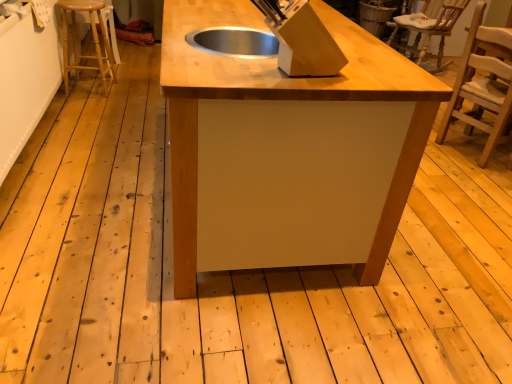
Question: Considering the relative positions of light brown wooden chair at right, placed as the first chair when sorted from bottom to top, and matte wood table at center in the image provided, is light brown wooden chair at right, placed as the first chair when sorted from bottom to top, to the right of matte wood table at center from the viewer's perspective?

Choices:
 (A) no
 (B) yes

Answer: (B)

Question: Considering the relative sizes of light brown wooden chair at right, placed as the first chair when sorted from bottom to top, and matte wood table at center in the image provided, is light brown wooden chair at right, placed as the first chair when sorted from bottom to top, shorter than matte wood table at center?

Choices:
 (A) yes
 (B) no

Answer: (B)

Question: Is light brown wooden chair at right, which is counted as the 2th chair, starting from the top, smaller than matte wood table at center?

Choices:
 (A) yes
 (B) no

Answer: (A)

Question: Can matte wood table at center be found inside light brown wooden chair at right, which is counted as the 2th chair, starting from the top?

Choices:
 (A) yes
 (B) no

Answer: (B)

Question: Does light brown wooden chair at right, placed as the first chair when sorted from bottom to top, come in front of matte wood table at center?

Choices:
 (A) yes
 (B) no

Answer: (B)

Question: Can you confirm if light brown wooden chair at right, which ranks as the first chair in front-to-back order, is taller than matte wood table at center?

Choices:
 (A) no
 (B) yes

Answer: (B)

Question: From the image's perspective, would you say wooden chair at upper right, which is counted as the first chair, starting from the back, is shown under light brown wooden chair at right, which ranks as the first chair in front-to-back order?

Choices:
 (A) yes
 (B) no

Answer: (B)

Question: Is wooden chair at upper right, which is counted as the first chair, starting from the back, placed right next to light brown wooden chair at right, marked as the 2th chair in a back-to-front arrangement?

Choices:
 (A) yes
 (B) no

Answer: (B)

Question: Is wooden chair at upper right, which is counted as the first chair, starting from the back, oriented away from light brown wooden chair at right, placed as the first chair when sorted from bottom to top?

Choices:
 (A) no
 (B) yes

Answer: (A)

Question: From a real-world perspective, is wooden chair at upper right, which is the 1th chair in top-to-bottom order, on light brown wooden chair at right, marked as the 2th chair in a back-to-front arrangement?

Choices:
 (A) yes
 (B) no

Answer: (B)

Question: Would you say wooden chair at upper right, which is counted as the first chair, starting from the back, contains light brown wooden chair at right, marked as the 2th chair in a back-to-front arrangement?

Choices:
 (A) yes
 (B) no

Answer: (B)

Question: Can you confirm if wooden chair at upper right, which is counted as the first chair, starting from the back, is positioned to the left of light brown wooden chair at right, marked as the 2th chair in a back-to-front arrangement?

Choices:
 (A) yes
 (B) no

Answer: (B)

Question: From a real-world perspective, does wooden chair at upper right, which is the 2th chair from front to back, stand above matte wood table at center?

Choices:
 (A) no
 (B) yes

Answer: (A)